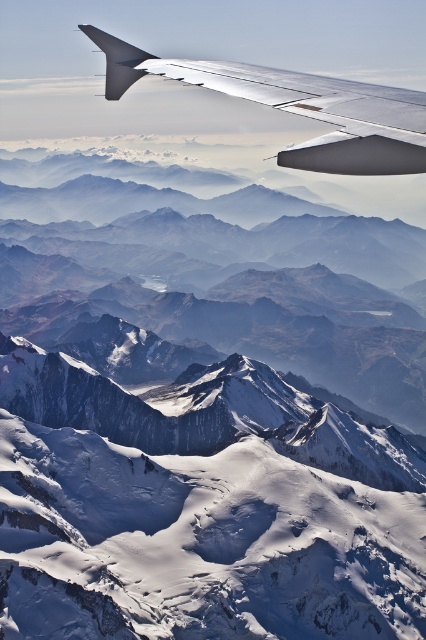
Is white snow-covered mountain range at center thinner than metallic silver wing at upper center?

No.

Is white snow-covered mountain range at center in front of metallic silver wing at upper center?

No.

Locate an element on the screen. This screenshot has width=426, height=640. white snow-covered mountain range at center is located at coordinates (227, 284).